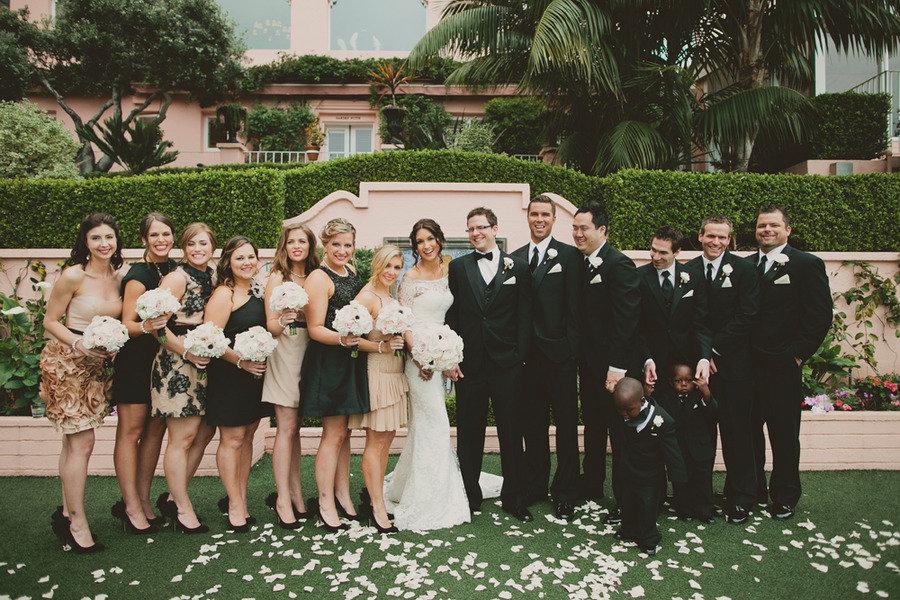
The width and height of the screenshot is (900, 600). What are the coordinates of `flower bouquets` in the screenshot? It's located at (451, 357), (394, 317), (353, 323), (290, 297), (259, 343), (203, 343), (155, 306), (103, 333).